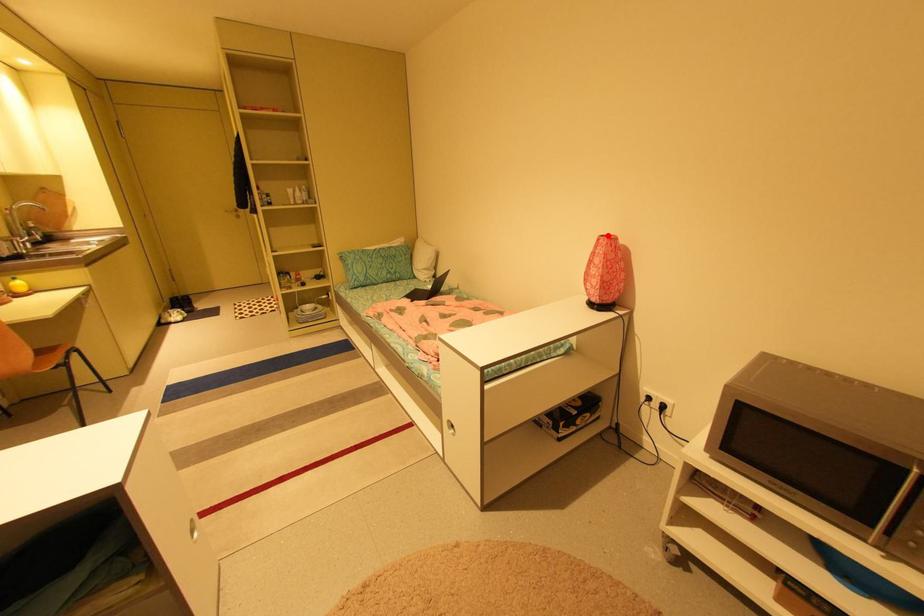
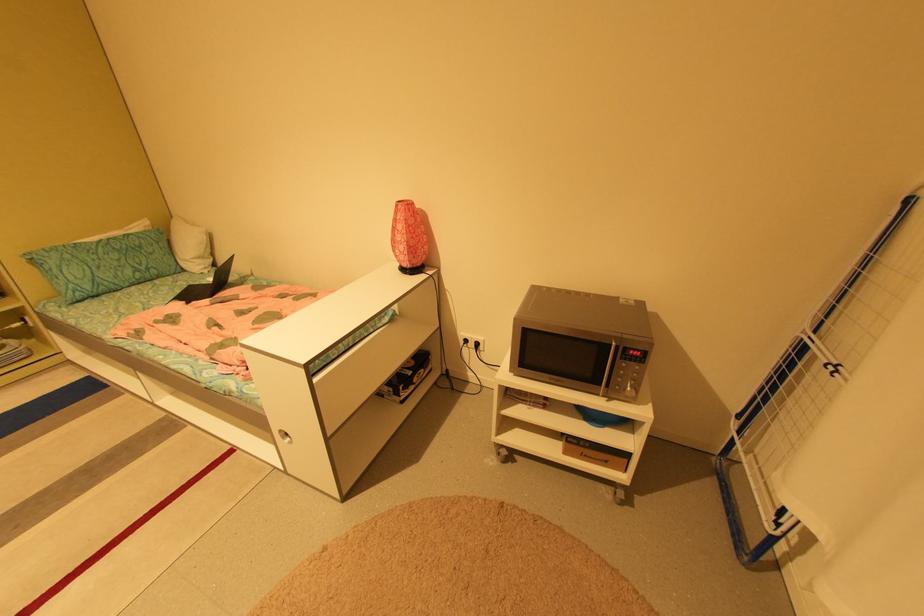
Locate, in the second image, the point that corresponds to the highlighted location in the first image.

(406, 201)